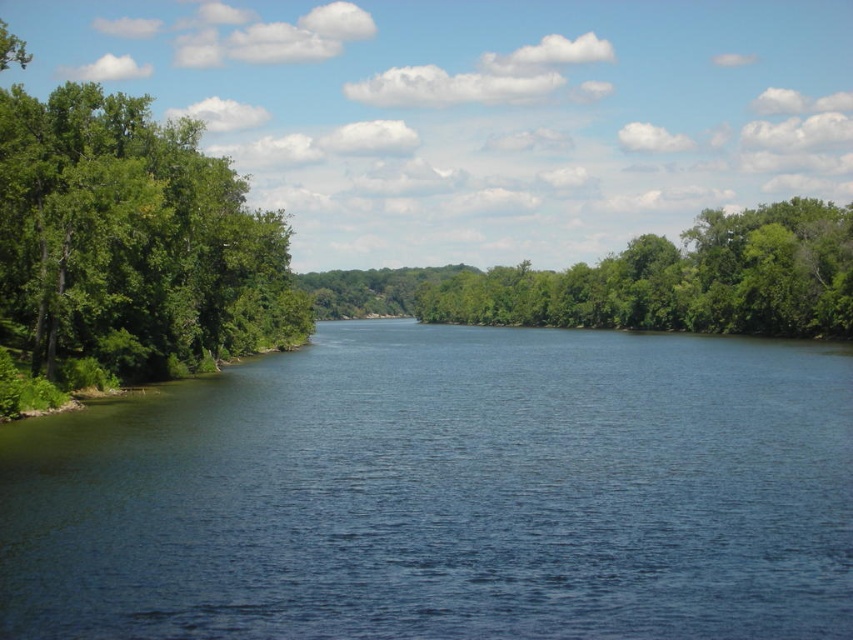
Is blue water at center wider than green leafy tree at center?

No.

Can you confirm if blue water at center is taller than green leafy tree at center?

In fact, blue water at center may be shorter than green leafy tree at center.

I want to click on blue water at center, so click(x=445, y=493).

At what (x,y) coordinates should I click in order to perform the action: click on blue water at center. Please return your answer as a coordinate pair (x, y). Looking at the image, I should click on (445, 493).

Is point (173, 593) positioned before point (90, 214)?

Yes.

This screenshot has width=853, height=640. Find the location of `blue water at center`. blue water at center is located at coordinates (445, 493).

Identify the location of blue water at center. This screenshot has height=640, width=853. (445, 493).

Does point (274, 337) lie behind point (643, 246)?

No, it is in front of (643, 246).

Is green leafy trees at left to the right of green leafy tree at center from the viewer's perspective?

No, green leafy trees at left is not to the right of green leafy tree at center.

Locate an element on the screen. green leafy trees at left is located at coordinates (131, 243).